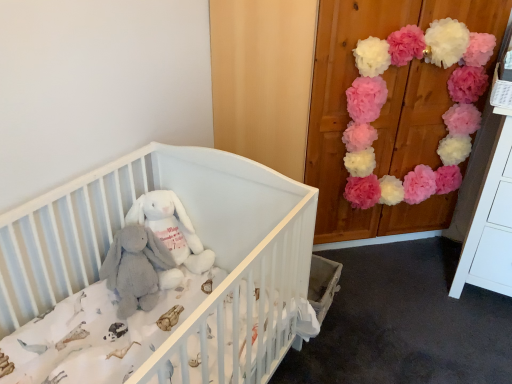
Question: Does white soft crib at center have a greater height compared to gray plush elephant at center?

Choices:
 (A) yes
 (B) no

Answer: (A)

Question: From a real-world perspective, is white soft crib at center located beneath gray plush elephant at center?

Choices:
 (A) no
 (B) yes

Answer: (B)

Question: Does white soft crib at center appear on the right side of gray plush elephant at center?

Choices:
 (A) yes
 (B) no

Answer: (A)

Question: Is white soft crib at center completely or partially outside of gray plush elephant at center?

Choices:
 (A) yes
 (B) no

Answer: (A)

Question: Is white soft crib at center oriented away from gray plush elephant at center?

Choices:
 (A) no
 (B) yes

Answer: (B)

Question: Is white soft crib at center far from gray plush elephant at center?

Choices:
 (A) yes
 (B) no

Answer: (B)

Question: Does white plush rabbit at center come in front of gray plush elephant at center?

Choices:
 (A) no
 (B) yes

Answer: (A)

Question: Is white plush rabbit at center aimed at gray plush elephant at center?

Choices:
 (A) no
 (B) yes

Answer: (B)

Question: From the image's perspective, is white plush rabbit at center on top of gray plush elephant at center?

Choices:
 (A) yes
 (B) no

Answer: (A)

Question: Is gray plush elephant at center located within white plush rabbit at center?

Choices:
 (A) yes
 (B) no

Answer: (A)

Question: Does white plush rabbit at center have a smaller size compared to gray plush elephant at center?

Choices:
 (A) yes
 (B) no

Answer: (A)

Question: Is the position of white plush rabbit at center more distant than that of gray plush elephant at center?

Choices:
 (A) yes
 (B) no

Answer: (A)

Question: Is white soft crib at center placed right next to white plush rabbit at center?

Choices:
 (A) yes
 (B) no

Answer: (B)